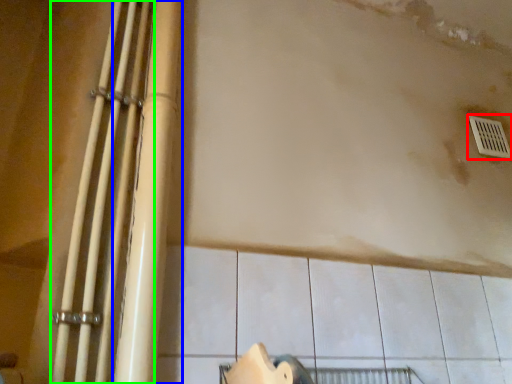
Question: Based on their relative distances, which object is nearer to window (highlighted by a red box)? Choose from beam (highlighted by a blue box) and beam (highlighted by a green box).

Choices:
 (A) beam
 (B) beam

Answer: (A)